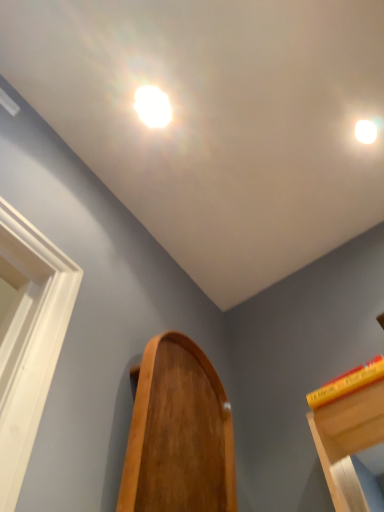
Question: Considering the relative sizes of wooden mirror at center and white glossy droplight at upper center, positioned as the second droplight in back-to-front order, in the image provided, is wooden mirror at center taller than white glossy droplight at upper center, positioned as the second droplight in back-to-front order,?

Choices:
 (A) yes
 (B) no

Answer: (A)

Question: From the image's perspective, does wooden mirror at center appear lower than white glossy droplight at upper center, positioned as the second droplight in back-to-front order?

Choices:
 (A) yes
 (B) no

Answer: (A)

Question: Is wooden mirror at center smaller than white glossy droplight at upper center, which is the second droplight from right to left?

Choices:
 (A) no
 (B) yes

Answer: (A)

Question: Does wooden mirror at center have a lesser height compared to white glossy droplight at upper center, positioned as the second droplight in back-to-front order?

Choices:
 (A) no
 (B) yes

Answer: (A)

Question: Is wooden mirror at center at the right side of white glossy droplight at upper center, arranged as the 1th droplight when viewed from the left?

Choices:
 (A) no
 (B) yes

Answer: (B)

Question: From the image's perspective, is wooden mirror at center above white glossy droplight at upper center, which is the second droplight from right to left?

Choices:
 (A) no
 (B) yes

Answer: (A)

Question: From the image's perspective, is wooden mirror at center above yellow matte book at upper right?

Choices:
 (A) yes
 (B) no

Answer: (B)

Question: Is wooden mirror at center completely or partially outside of yellow matte book at upper right?

Choices:
 (A) yes
 (B) no

Answer: (A)

Question: Is wooden mirror at center to the left of yellow matte book at upper right from the viewer's perspective?

Choices:
 (A) yes
 (B) no

Answer: (A)

Question: Are wooden mirror at center and yellow matte book at upper right located far from each other?

Choices:
 (A) yes
 (B) no

Answer: (B)

Question: From a real-world perspective, is wooden mirror at center positioned over yellow matte book at upper right based on gravity?

Choices:
 (A) yes
 (B) no

Answer: (B)

Question: Is wooden mirror at center positioned in front of yellow matte book at upper right?

Choices:
 (A) no
 (B) yes

Answer: (B)

Question: Is white glossy droplight at upper right, which is counted as the first droplight, starting from the back, positioned before yellow matte book at upper right?

Choices:
 (A) no
 (B) yes

Answer: (A)